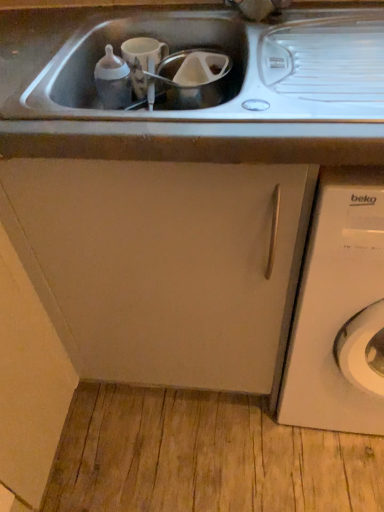
Question: Is matte white cabinet at center bigger than white matte washing machine at right?

Choices:
 (A) yes
 (B) no

Answer: (A)

Question: Could you tell me if matte white cabinet at center is turned towards white matte washing machine at right?

Choices:
 (A) yes
 (B) no

Answer: (B)

Question: Is matte white cabinet at center not inside white matte washing machine at right?

Choices:
 (A) no
 (B) yes

Answer: (B)

Question: Considering the relative positions of matte white cabinet at center and white matte washing machine at right in the image provided, is matte white cabinet at center to the left of white matte washing machine at right from the viewer's perspective?

Choices:
 (A) yes
 (B) no

Answer: (A)

Question: Is matte white cabinet at center closer to camera compared to white matte washing machine at right?

Choices:
 (A) yes
 (B) no

Answer: (B)

Question: Considering the relative sizes of matte white cabinet at center and white matte washing machine at right in the image provided, is matte white cabinet at center smaller than white matte washing machine at right?

Choices:
 (A) no
 (B) yes

Answer: (A)

Question: From the image's perspective, is white matte washing machine at right on top of matte white cabinet at center?

Choices:
 (A) yes
 (B) no

Answer: (B)

Question: Does white matte washing machine at right have a lesser height compared to matte white cabinet at center?

Choices:
 (A) yes
 (B) no

Answer: (B)

Question: Is white matte washing machine at right positioned with its back to matte white cabinet at center?

Choices:
 (A) yes
 (B) no

Answer: (B)

Question: Is white matte washing machine at right at the right side of matte white cabinet at center?

Choices:
 (A) yes
 (B) no

Answer: (A)

Question: Can you confirm if white matte washing machine at right is wider than matte white cabinet at center?

Choices:
 (A) yes
 (B) no

Answer: (A)

Question: Is white matte washing machine at right outside matte white cabinet at center?

Choices:
 (A) no
 (B) yes

Answer: (B)

Question: From the image's perspective, is white matte washing machine at right located above or below matte white cabinet at center?

Choices:
 (A) above
 (B) below

Answer: (B)